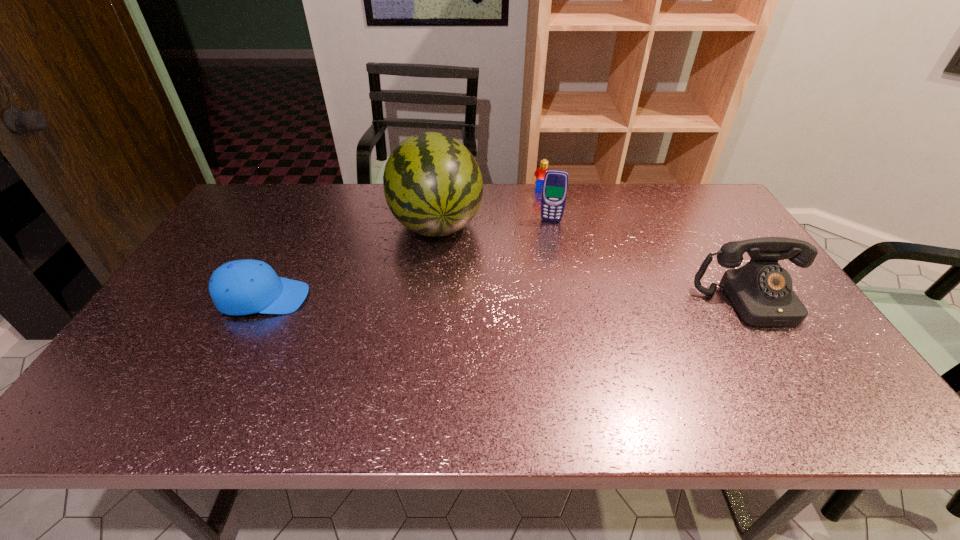
At what (x,y) coordinates should I click in order to perform the action: click on free space between the cellular telephone and the telephone. Please return your answer as a coordinate pair (x, y). This screenshot has width=960, height=540. Looking at the image, I should click on click(x=651, y=261).

Where is `unoccupied area between the telephone and the leftmost object`? unoccupied area between the telephone and the leftmost object is located at coordinates (507, 300).

Where is `empty space that is in between the rightmost object and the cap`? The image size is (960, 540). empty space that is in between the rightmost object and the cap is located at coordinates (507, 300).

The width and height of the screenshot is (960, 540). In order to click on vacant region between the rightmost object and the cap in this screenshot , I will do `click(507, 300)`.

What are the coordinates of `free space between the watermelon and the cellular telephone` in the screenshot? It's located at (493, 222).

Identify the location of object that is the second closest one to the watermelon. (555, 185).

Select which object is the closest to the cap. Please provide its 2D coordinates. Your answer should be formatted as a tuple, i.e. [(x, y)], where the tuple contains the x and y coordinates of a point satisfying the conditions above.

[(433, 186)]

Identify the location of vacant position in the image that satisfies the following two spatial constraints: 1. on the back side of the cellular telephone; 2. on the left side of the fourth object from right to left. The height and width of the screenshot is (540, 960). (437, 220).